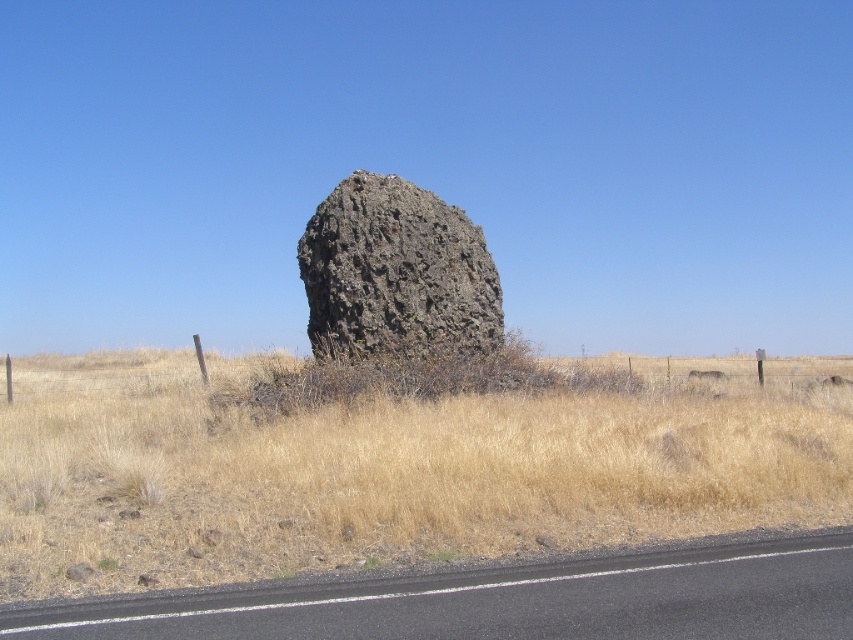
Between dry grass at center and rusty stone boulder at center, which one is positioned lower?

dry grass at center is lower down.

How far apart are dry grass at center and rusty stone boulder at center?

The distance of dry grass at center from rusty stone boulder at center is 6.24 meters.

Is point (708, 417) positioned before point (483, 253)?

Yes.

The image size is (853, 640). I want to click on dry grass at center, so click(393, 468).

Does black asphalt road at lower center have a greater height compared to rusty stone boulder at center?

In fact, black asphalt road at lower center may be shorter than rusty stone boulder at center.

This screenshot has height=640, width=853. What do you see at coordinates (508, 600) in the screenshot?
I see `black asphalt road at lower center` at bounding box center [508, 600].

Describe the element at coordinates (508, 600) in the screenshot. The image size is (853, 640). I see `black asphalt road at lower center` at that location.

Locate an element on the screen. The height and width of the screenshot is (640, 853). black asphalt road at lower center is located at coordinates (508, 600).

Is point (778, 493) more distant than point (123, 625)?

That is True.

Find the location of a particular element. Image resolution: width=853 pixels, height=640 pixels. dry grass at center is located at coordinates (393, 468).